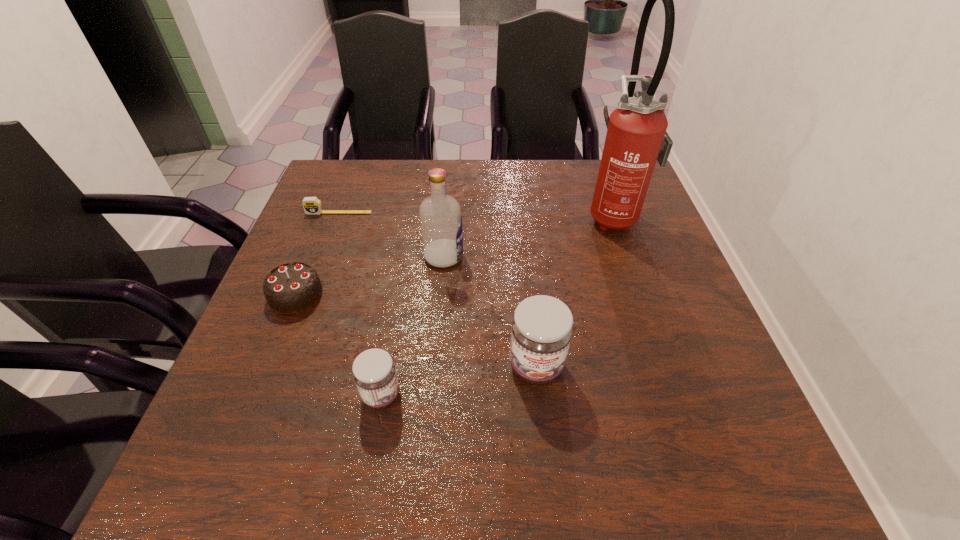
Given the evenly spaced jams in the image, where should an extra jam be added on the right to preserve the spacing? Please point to a vacant space. Please provide its 2D coordinates. Your answer should be formatted as a tuple, i.e. [(x, y)], where the tuple contains the x and y coordinates of a point satisfying the conditions above.

[(676, 340)]